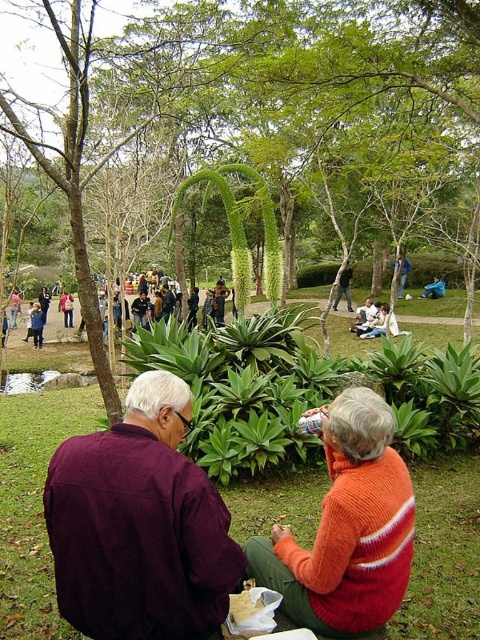
Between point (444, 115) and point (179, 349), which one is positioned behind?

The point (444, 115) is behind.

Is green leafy tree at center above green leafy plants at center?

Indeed, green leafy tree at center is positioned over green leafy plants at center.

Identify the location of green leafy tree at center. This screenshot has width=480, height=640. (288, 100).

How much distance is there between maroon fabric shirt at center and orange knitted sweater at lower right?

maroon fabric shirt at center is 59.88 centimeters from orange knitted sweater at lower right.

Is point (152, 454) closer to viewer compared to point (360, 598)?

Yes, it is in front of point (360, 598).

This screenshot has width=480, height=640. I want to click on maroon fabric shirt at center, so (140, 525).

Does point (191, 627) come farther from viewer compared to point (441, 292)?

No.

Is maroon fabric shirt at center below blue fabric bag at center?

Yes.

Identify the location of maroon fabric shirt at center. (140, 525).